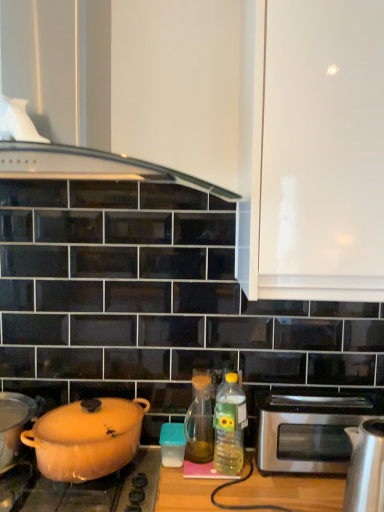
Question: Can you confirm if matte orange pot at left, which ranks as the 3th kitchen appliance in top-to-bottom order, is smaller than satin silver kettle at right, which appears as the 2th kitchen appliance when ordered from the bottom?

Choices:
 (A) yes
 (B) no

Answer: (A)

Question: From the image's perspective, is matte orange pot at left, which ranks as the 3th kitchen appliance in top-to-bottom order, on satin silver kettle at right, marked as the fourth kitchen appliance in a top-to-bottom arrangement?

Choices:
 (A) no
 (B) yes

Answer: (B)

Question: Is matte orange pot at left, which is the 5th kitchen appliance from right to left, placed right next to satin silver kettle at right, the 5th kitchen appliance when ordered from left to right?

Choices:
 (A) no
 (B) yes

Answer: (A)

Question: Is matte orange pot at left, which appears as the 1th kitchen appliance when viewed from the left, closer to camera compared to satin silver kettle at right, marked as the fourth kitchen appliance in a top-to-bottom arrangement?

Choices:
 (A) no
 (B) yes

Answer: (A)

Question: Is matte orange pot at left, which ranks as the 3th kitchen appliance in top-to-bottom order, at the left side of satin silver kettle at right, the 1th kitchen appliance in the right-to-left sequence?

Choices:
 (A) yes
 (B) no

Answer: (A)

Question: Considering their positions, is matte orange pot at left, which appears as the 1th kitchen appliance when viewed from the left, located in front of or behind translucent amber glass at center, the 2th bottle when ordered from right to left?

Choices:
 (A) behind
 (B) front

Answer: (B)

Question: Is matte orange pot at left, which ranks as the third kitchen appliance in bottom-to-top order, situated inside translucent amber glass at center, which is counted as the first bottle, starting from the left, or outside?

Choices:
 (A) outside
 (B) inside

Answer: (A)

Question: From a real-world perspective, is matte orange pot at left, which is the 5th kitchen appliance from right to left, positioned above or below translucent amber glass at center, the 2th bottle when ordered from right to left?

Choices:
 (A) above
 (B) below

Answer: (B)

Question: Is point (28, 420) closer or farther from the camera than point (200, 418)?

Choices:
 (A) farther
 (B) closer

Answer: (B)

Question: From a real-world perspective, is matte orange pot at lower left, which is the third kitchen appliance from left to right, physically located above or below translucent plastic container at center, acting as the second kitchen appliance starting from the right?

Choices:
 (A) below
 (B) above

Answer: (B)

Question: Is matte orange pot at lower left, placed as the 3th kitchen appliance when sorted from right to left, inside the boundaries of translucent plastic container at center, acting as the second kitchen appliance starting from the right, or outside?

Choices:
 (A) inside
 (B) outside

Answer: (B)

Question: Considering their positions, is matte orange pot at lower left, which ranks as the 4th kitchen appliance in bottom-to-top order, located in front of or behind translucent plastic container at center, acting as the second kitchen appliance starting from the right?

Choices:
 (A) front
 (B) behind

Answer: (A)

Question: From the image's perspective, is matte orange pot at lower left, which is the third kitchen appliance from left to right, positioned above or below translucent plastic container at center, acting as the 4th kitchen appliance starting from the left?

Choices:
 (A) below
 (B) above

Answer: (B)

Question: From the image's perspective, relative to matte orange pot at left, which ranks as the 3th kitchen appliance in top-to-bottom order, is matte orange pot at lower left above or below?

Choices:
 (A) below
 (B) above

Answer: (A)

Question: From a real-world perspective, is matte orange pot at lower left above or below matte orange pot at left, which ranks as the 3th kitchen appliance in top-to-bottom order?

Choices:
 (A) above
 (B) below

Answer: (B)